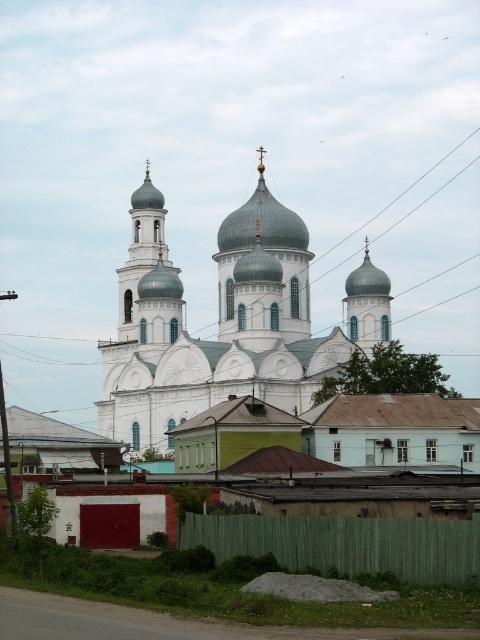
You are a photographer planning to capture the white stone church at center and the white stone dome at center in a single shot. Considering their heights, which one will appear larger in the photo?

The white stone church at center is much taller than the white stone dome at center, so it will appear larger in the photo.